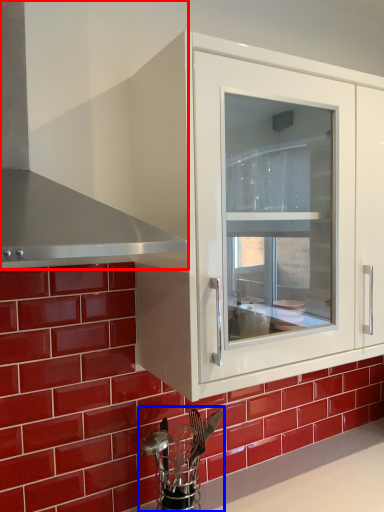
Question: Which point is closer to the camera, exhaust hood (highlighted by a red box) or appliance (highlighted by a blue box)?

Choices:
 (A) exhaust hood
 (B) appliance

Answer: (A)